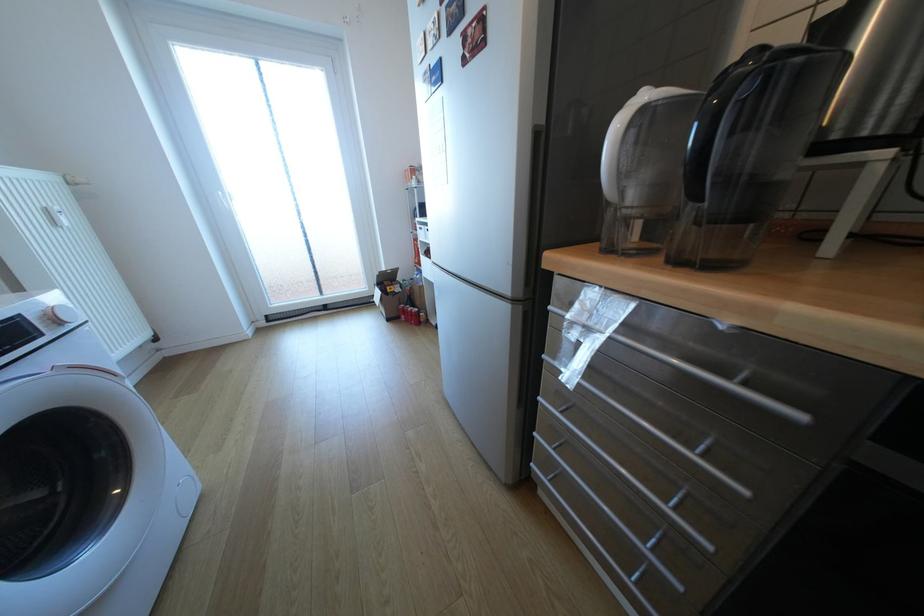
The image size is (924, 616). In order to click on white pitcher handle in this screenshot , I will do `click(614, 150)`.